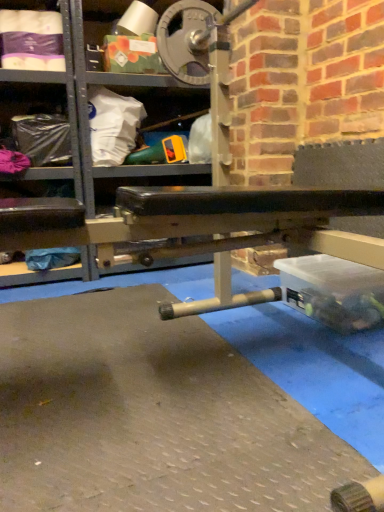
Question: From their relative heights in the image, would you say clear plastic bag at left, the 1th shelf when ordered from left to right, is taller or shorter than black rubber bench at center, placed as the 1th shelf when sorted from right to left?

Choices:
 (A) tall
 (B) short

Answer: (B)

Question: Is clear plastic bag at left, the 1th shelf when ordered from left to right, situated inside black rubber bench at center, which is the second shelf in left-to-right order, or outside?

Choices:
 (A) outside
 (B) inside

Answer: (A)

Question: Looking at their shapes, would you say clear plastic bag at left, which ranks as the 2th shelf in right-to-left order, is wider or thinner than black rubber bench at center, placed as the 1th shelf when sorted from right to left?

Choices:
 (A) wide
 (B) thin

Answer: (B)

Question: Considering their positions, is black rubber bench at center, which is the second shelf in left-to-right order, located in front of or behind clear plastic bag at left, which ranks as the 2th shelf in right-to-left order?

Choices:
 (A) behind
 (B) front

Answer: (B)

Question: From the image's perspective, is black rubber bench at center, placed as the 1th shelf when sorted from right to left, above or below clear plastic bag at left, the 1th shelf when ordered from left to right?

Choices:
 (A) above
 (B) below

Answer: (A)

Question: Is black rubber bench at center, which is the second shelf in left-to-right order, wider or thinner than clear plastic bag at left, the 1th shelf when ordered from left to right?

Choices:
 (A) wide
 (B) thin

Answer: (A)

Question: Visually, is black rubber bench at center, placed as the 1th shelf when sorted from right to left, positioned to the left or to the right of clear plastic bag at left, which ranks as the 2th shelf in right-to-left order?

Choices:
 (A) right
 (B) left

Answer: (A)